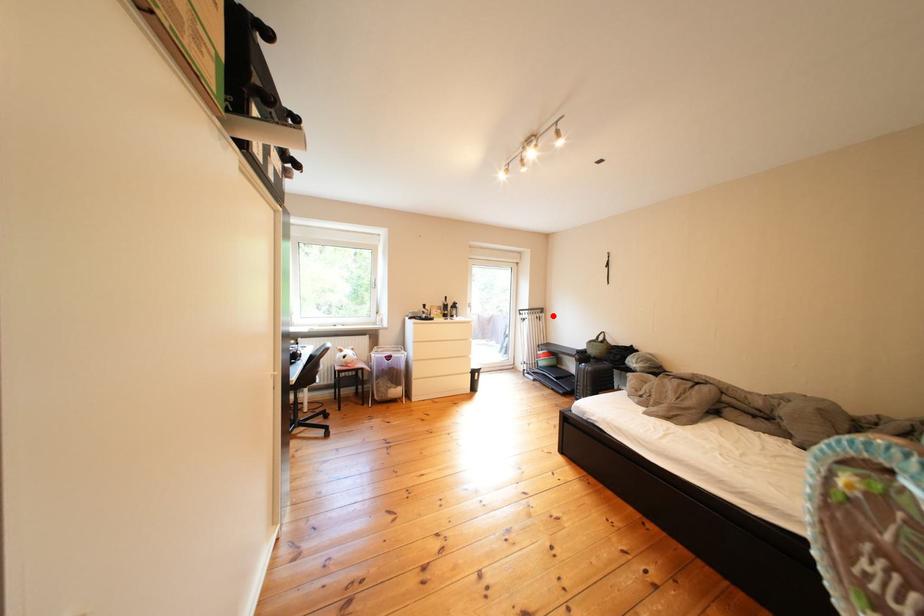
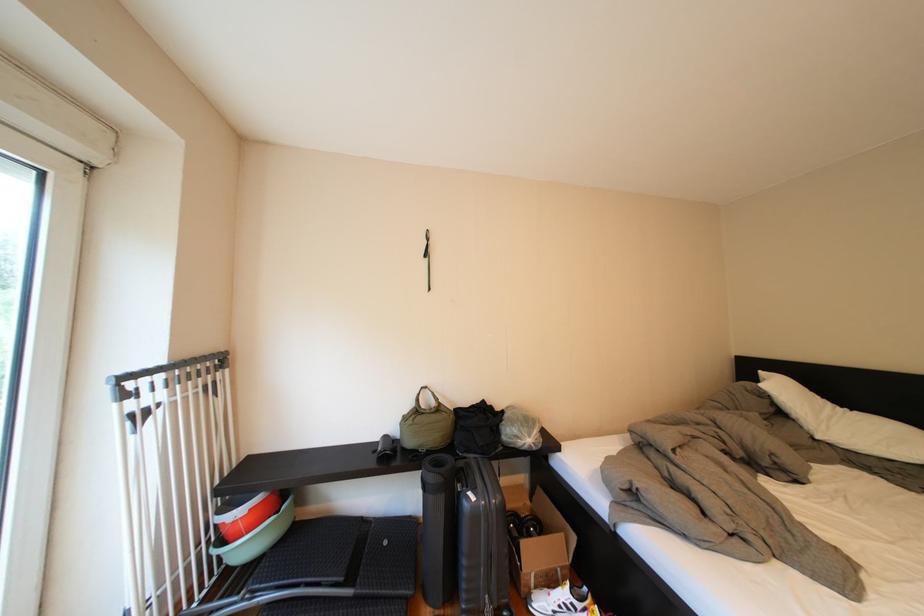
Where in the second image is the point corresponding to the highlighted location from the first image?

(224, 369)